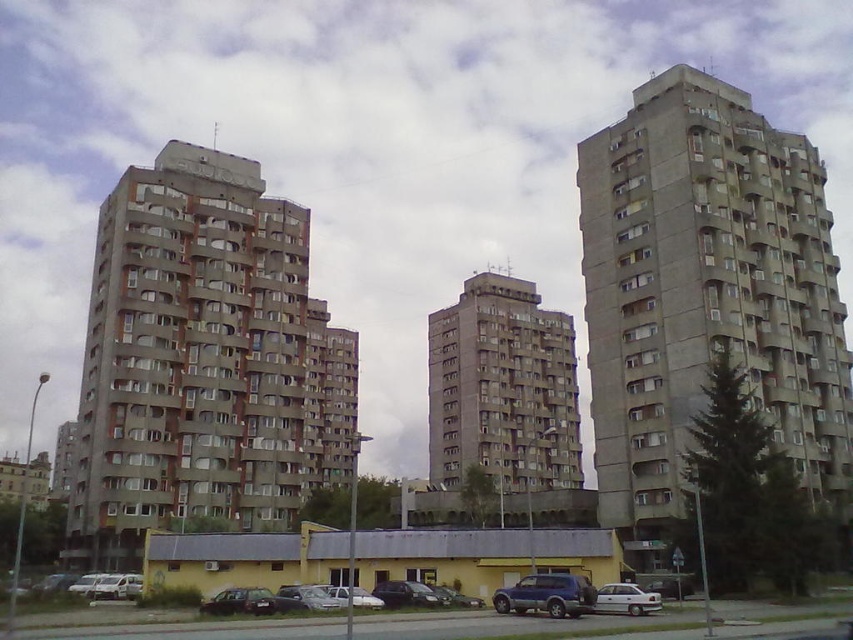
Question: Is gray concrete building at center positioned in front of silver metallic hatchback at center?

Choices:
 (A) no
 (B) yes

Answer: (A)

Question: Does gray concrete building at center come behind concrete block building at center?

Choices:
 (A) yes
 (B) no

Answer: (B)

Question: Which of the following is the farthest from the observer?

Choices:
 (A) silver metallic car at lower left
 (B) shiny black suv at center
 (C) concrete block building at center
 (D) concrete building at center

Answer: (C)

Question: Can you confirm if concrete building at center is bigger than metallic blue suv at center?

Choices:
 (A) yes
 (B) no

Answer: (A)

Question: Which point is farther to the camera?

Choices:
 (A) (x=131, y=579)
 (B) (x=358, y=588)
 (C) (x=810, y=406)
 (D) (x=396, y=596)

Answer: (C)

Question: Estimate the real-world distances between objects in this image. Which object is farther from the white matte car at lower center?

Choices:
 (A) silver metallic car at lower left
 (B) shiny black suv at center
 (C) gray concrete building at center

Answer: (C)